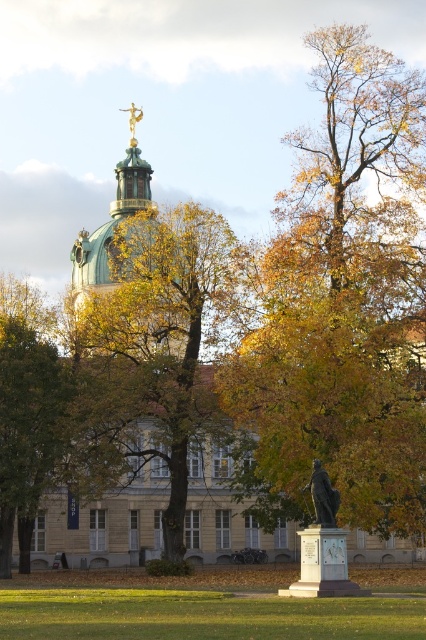
Question: Is golden-brown foliage at center to the right of green copper dome at upper center from the viewer's perspective?

Choices:
 (A) yes
 (B) no

Answer: (A)

Question: Is green copper dome at upper center positioned before bronze statue at center?

Choices:
 (A) no
 (B) yes

Answer: (A)

Question: Which point is farther to the camera?

Choices:
 (A) golden-brown foliage at center
 (B) yellow-green leaves at center
 (C) bronze statue at center

Answer: (A)

Question: Which point is closer to the camera?

Choices:
 (A) (131, 259)
 (B) (337, 356)

Answer: (B)

Question: Which of the following is the farthest from the observer?

Choices:
 (A) bronze statue at center
 (B) gold metallic statue at upper center

Answer: (B)

Question: Can you confirm if green copper dome at upper center is positioned to the right of bronze statue at center?

Choices:
 (A) yes
 (B) no

Answer: (B)